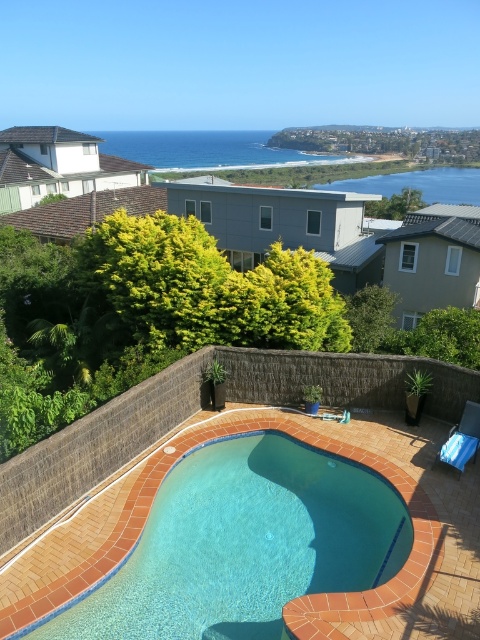
Question: Is blue water at upper center positioned in front of blue water at center?

Choices:
 (A) yes
 (B) no

Answer: (A)

Question: Considering the real-world distances, which object is farthest from the clear glass pool at center?

Choices:
 (A) blue water at upper center
 (B) blue water at center

Answer: (A)

Question: Is clear glass pool at center positioned behind blue water at center?

Choices:
 (A) yes
 (B) no

Answer: (B)

Question: Can you confirm if clear glass pool at center is wider than blue water at center?

Choices:
 (A) no
 (B) yes

Answer: (A)

Question: Based on their relative distances, which object is farther from the blue water at upper center?

Choices:
 (A) clear glass pool at center
 (B) blue water at center

Answer: (A)

Question: Which point is farther to the camera?

Choices:
 (A) blue water at upper center
 (B) blue water at center

Answer: (B)